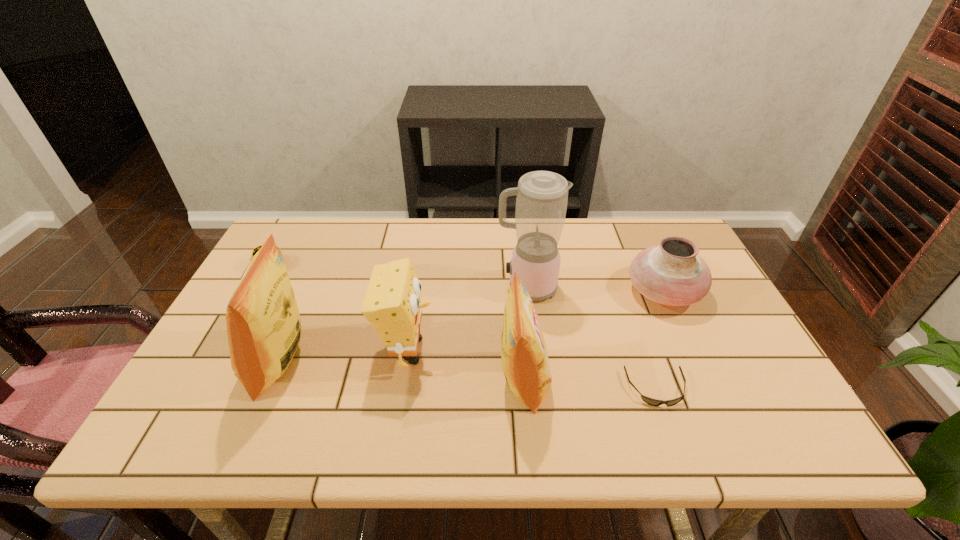
Where is `free space located 0.080m on the front-facing side of the taller crisp (potato chip)`? free space located 0.080m on the front-facing side of the taller crisp (potato chip) is located at coordinates (219, 362).

Locate an element on the screen. The width and height of the screenshot is (960, 540). vacant space located on the front-facing side of the taller crisp (potato chip) is located at coordinates (223, 362).

At what (x,y) coordinates should I click in order to perform the action: click on vacant region located 0.120m on the front-facing side of the right crisp (potato chip). Please return your answer as a coordinate pair (x, y). Looking at the image, I should click on (599, 380).

Find the location of a particular element. This screenshot has height=540, width=960. vacant space located on the front of the leftmost object is located at coordinates (240, 321).

I want to click on free spot located on the back of the third shortest object, so click(645, 251).

Locate an element on the screen. blank space located 0.150m on the base of the food processor near the control knob is located at coordinates (444, 288).

Locate an element on the screen. This screenshot has height=540, width=960. vacant space positioned 0.240m on the base of the food processor near the control knob is located at coordinates (412, 288).

The image size is (960, 540). I want to click on free space located on the base of the food processor near the control knob, so click(x=419, y=288).

The image size is (960, 540). Find the location of `vacant area located 0.140m on the face of the sponge`. vacant area located 0.140m on the face of the sponge is located at coordinates (492, 350).

Locate an element on the screen. This screenshot has height=540, width=960. object that is at the far edge is located at coordinates (256, 249).